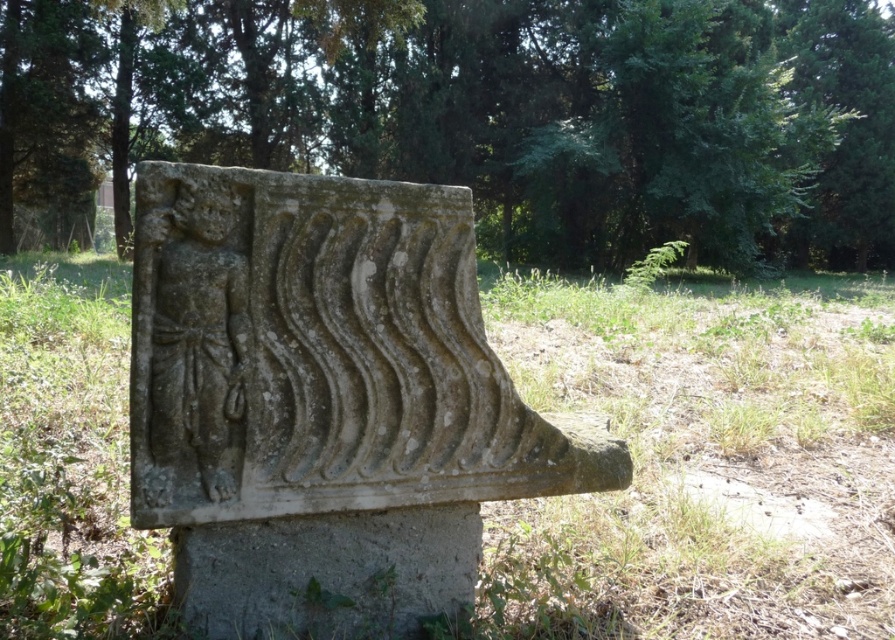
Between green stone carving at center and gray concrete at center, which one appears on the right side from the viewer's perspective?

green stone carving at center

Where is `green stone carving at center`? green stone carving at center is located at coordinates (479, 116).

Who is more forward, (743, 230) or (371, 563)?

Point (371, 563) is more forward.

Identify the location of green stone carving at center. The height and width of the screenshot is (640, 895). (479, 116).

Which is in front, point (317, 385) or point (179, 602)?

Point (317, 385) is in front.

Who is lower down, gray stone carving at center or gray concrete at center?

Positioned lower is gray concrete at center.

This screenshot has height=640, width=895. What do you see at coordinates (325, 401) in the screenshot? I see `gray stone carving at center` at bounding box center [325, 401].

Locate an element on the screen. This screenshot has width=895, height=640. gray stone carving at center is located at coordinates (325, 401).

Who is lower down, green stone carving at center or gray stone carving at center?

gray stone carving at center

Which is behind, point (831, 220) or point (207, 385)?

Point (831, 220)

Locate an element on the screen. The width and height of the screenshot is (895, 640). green stone carving at center is located at coordinates (479, 116).